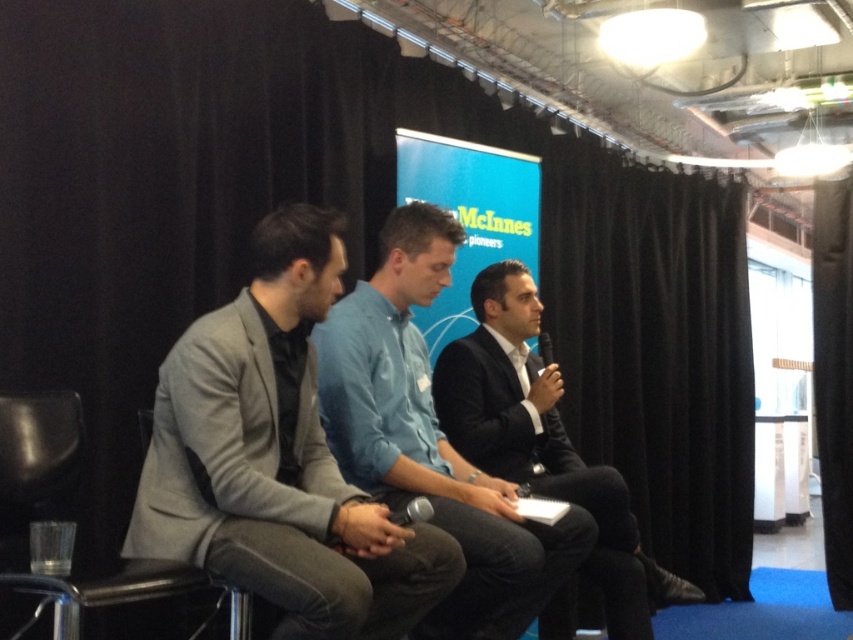
You are an event planner trying to set up a backdrop for a stage. You have a new black velvet curtain at upper center and a gray suit at left. Which one is bigger in size?

The black velvet curtain at upper center has a larger size compared to the gray suit at left.

What are the coordinates of the black leather chair at left?

The black leather chair at left is located at coordinates point (38, 444).

You are organizing a photo shoot and need to ensure that the black suit at center and the black leather chair at left will fit within a 2.5 meter wide backdrop. Given their sizes, can both items fit side by side without overlapping?

The black suit at center is wider than the black leather chair at left. To determine if they can fit side by side, we need to know the exact widths of both items. However, since the question only states that the black suit is wider than the chair but doesn